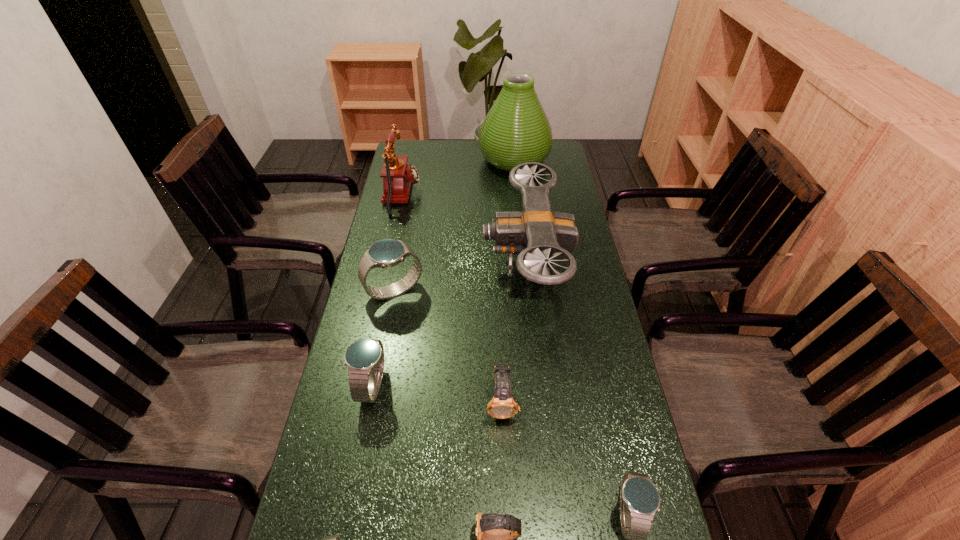
At what (x,y) coordinates should I click in order to perform the action: click on blue watch that is the second nearest to the telephone. Please return your answer as a coordinate pair (x, y). The width and height of the screenshot is (960, 540). Looking at the image, I should click on (364, 358).

Select which blue watch is the third closest to the bigger gold watch. Please provide its 2D coordinates. Your answer should be formatted as a tuple, i.e. [(x, y)], where the tuple contains the x and y coordinates of a point satisfying the conditions above.

[(385, 253)]

The height and width of the screenshot is (540, 960). I want to click on free space that satisfies the following two spatial constraints: 1. on the front side of the tallest object; 2. on the dial of the telephone, so click(x=518, y=195).